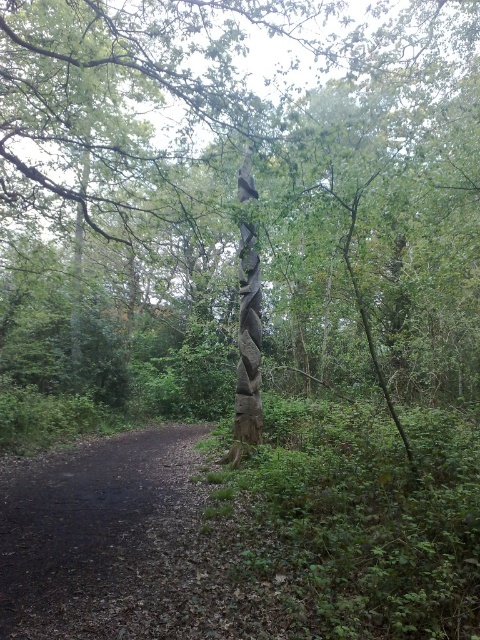
You are standing at the base of the tall wooden pole in the forest scene. You notice two points marked in the image. One is at coordinate point (236, 113) and the other at point (179, 541). If you want to reach the point closer to you, which coordinate should you head towards?

You should head towards point (236, 113) because it is further to the viewer than point (179, 541), making it closer to your current position at the base of the pole.